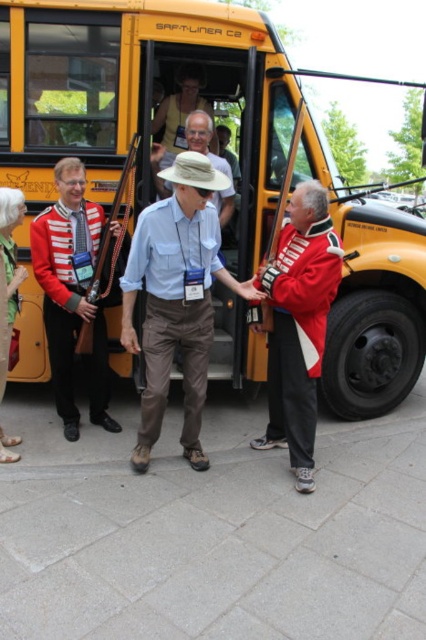
Question: Among these points, which one is farthest from the camera?

Choices:
 (A) (158, 22)
 (B) (273, 368)

Answer: (B)

Question: Is yellow matte school bus at center below light blue cotton shirt at center?

Choices:
 (A) no
 (B) yes

Answer: (A)

Question: Which object is positioned farthest from the green fabric dress at lower left?

Choices:
 (A) light blue cotton shirt at center
 (B) red and white striped uniform at center

Answer: (A)

Question: Can you confirm if yellow matte school bus at center is bigger than green fabric dress at lower left?

Choices:
 (A) no
 (B) yes

Answer: (B)

Question: Can you confirm if yellow matte school bus at center is positioned above green fabric dress at lower left?

Choices:
 (A) no
 (B) yes

Answer: (B)

Question: Which is farther from the red and white striped uniform at center?

Choices:
 (A) matte khaki hat at center
 (B) light blue cotton shirt at center
 (C) red wool jacket at center
 (D) green fabric dress at lower left

Answer: (C)